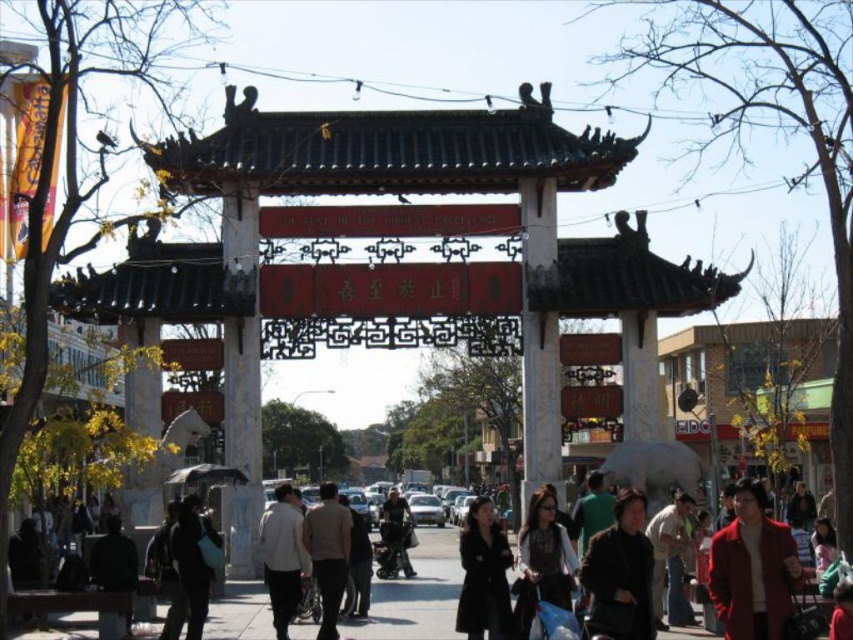
Does dark brown leather jacket at lower right have a greater width compared to dark gray coat at center?

Yes.

Who is higher up, dark brown leather jacket at lower right or dark gray coat at center?

dark brown leather jacket at lower right is above.

The width and height of the screenshot is (853, 640). Find the location of `dark brown leather jacket at lower right`. dark brown leather jacket at lower right is located at coordinates (619, 573).

Is dark brown leather jacket at lower center bigger than dark gray fabric stroller at center?

Indeed, dark brown leather jacket at lower center has a larger size compared to dark gray fabric stroller at center.

You are a GUI agent. You are given a task and a screenshot of the screen. Output one action in this format:
    pyautogui.click(x=<x>, y=<y>)
    Task: Click on the dark brown leather jacket at lower center
    The image size is (853, 640).
    Given the screenshot: What is the action you would take?
    pyautogui.click(x=543, y=561)

Locate an element on the screen. dark brown leather jacket at lower center is located at coordinates (543, 561).

Between dark brown leather jacket at lower center and dark brown leather jacket at center, which one has more height?

dark brown leather jacket at center

Image resolution: width=853 pixels, height=640 pixels. Identify the location of dark brown leather jacket at lower center. coord(543,561).

Locate an element on the screen. dark brown leather jacket at lower center is located at coordinates (543, 561).